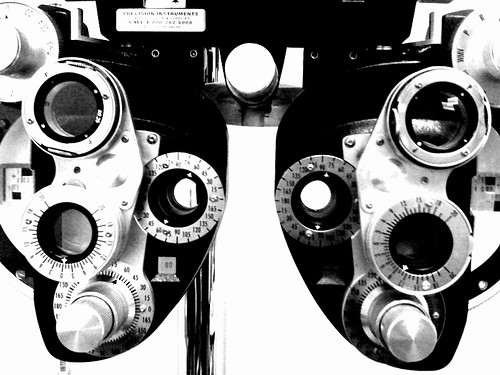
Locate an element on the screen. rod is located at coordinates (193, 326).